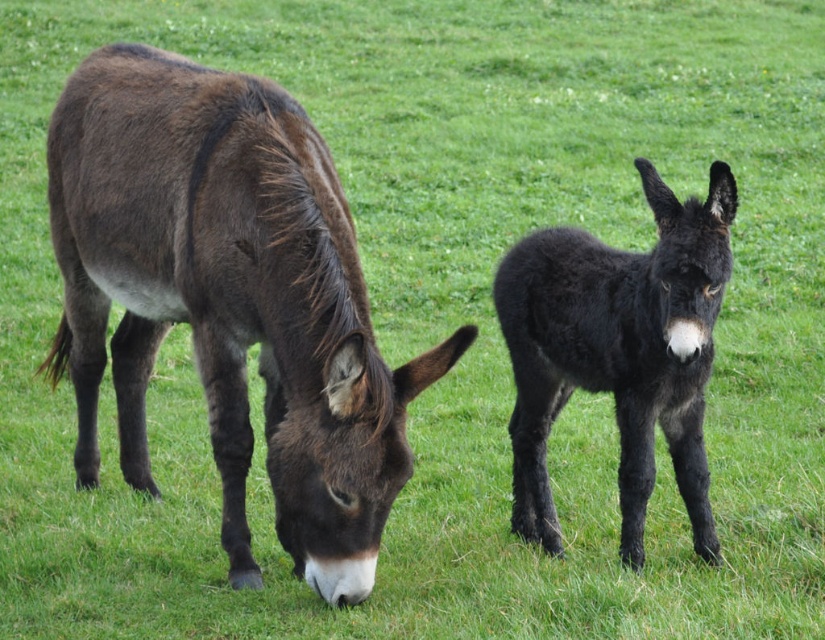
You are standing at the origin of the coordinate system in the image. You want to walk to the point at the bottom right corner of the image. Which point should you go through first, point (x=328, y=508) or point (x=693, y=292)?

Since point (x=328, y=508) is behind point (x=693, y=292), you should go through point (x=693, y=292) first before reaching point (x=328, y=508). Therefore, point (x=693, y=292) should be the first point to go through.

You are a farmer checking the field. You see the dark brown fur donkey at left and the black fuzzy donkey at center. Which one is taller?

The dark brown fur donkey at left is taller than the black fuzzy donkey at center.